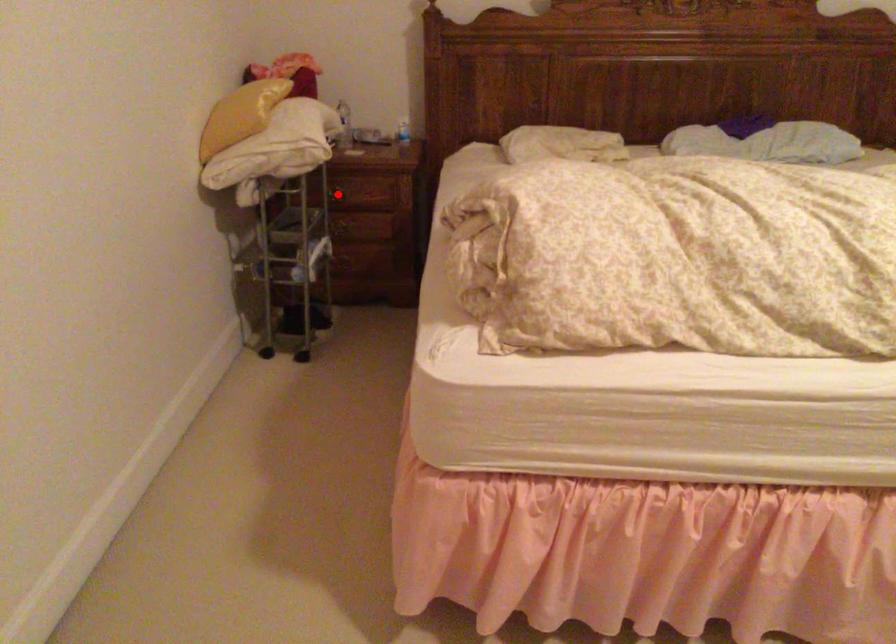
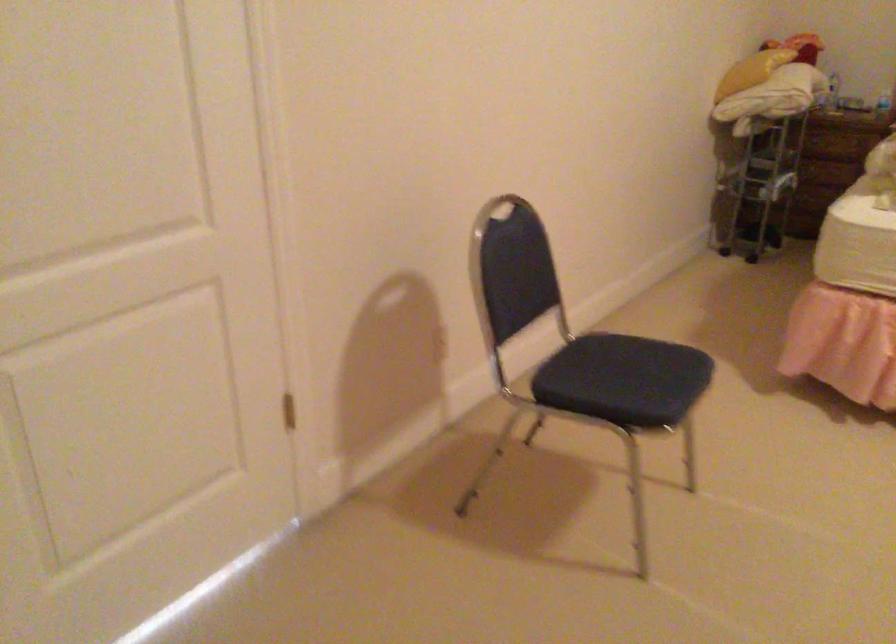
Question: I am providing you with two images of the same scene from different viewpoints. A red point is marked on the first image. At the location where the point appears in image 1, is it still visible in image 2?

Choices:
 (A) Yes
 (B) No

Answer: (B)